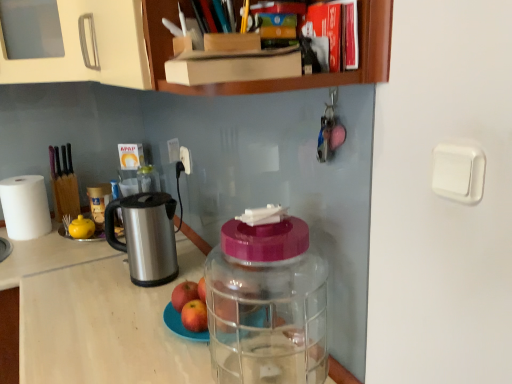
Question: From the image's perspective, relative to red matte apple at center, positioned as the 1th apple in front-to-back order, is white plastic power outlet at upper center above or below?

Choices:
 (A) above
 (B) below

Answer: (A)

Question: Considering the positions of white plastic power outlet at upper center and red matte apple at center, positioned as the 1th apple in front-to-back order, in the image, is white plastic power outlet at upper center taller or shorter than red matte apple at center, positioned as the 1th apple in front-to-back order,?

Choices:
 (A) tall
 (B) short

Answer: (A)

Question: Which object is the farthest from the red matte apple at center, the second apple from the back?

Choices:
 (A) red matte apple at center, which is the second apple in front-to-back order
 (B) transparent plastic bottle at center
 (C) stainless steel electric kettle at left
 (D) beige wood cabinet at upper left
 (E) transparent plastic container at center

Answer: (D)

Question: Estimate the real-world distances between objects in this image. Which object is closer to the transparent plastic bottle at center?

Choices:
 (A) stainless steel electric kettle at left
 (B) red matte apple at center, positioned as the 1th apple in front-to-back order
 (C) transparent plastic container at center
 (D) beige wood cabinet at upper left
 (E) white plastic power outlet at upper center

Answer: (B)